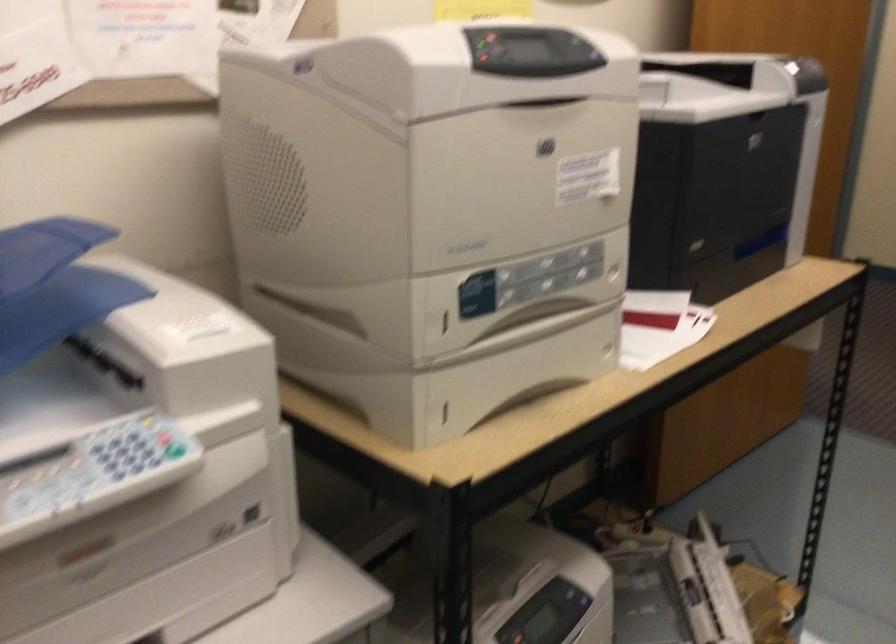
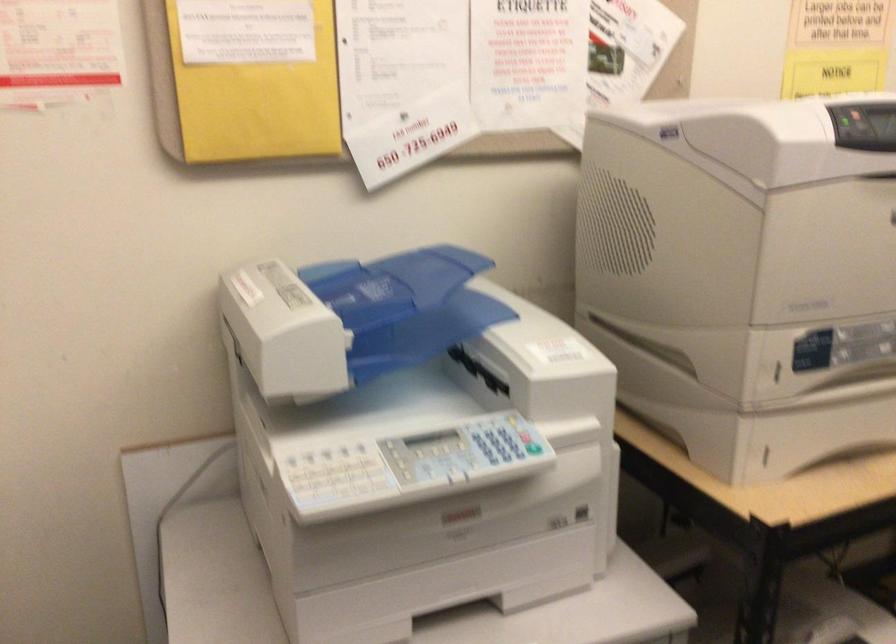
Locate, in the second image, the point that corresponds to point (127, 450) in the first image.

(495, 444)